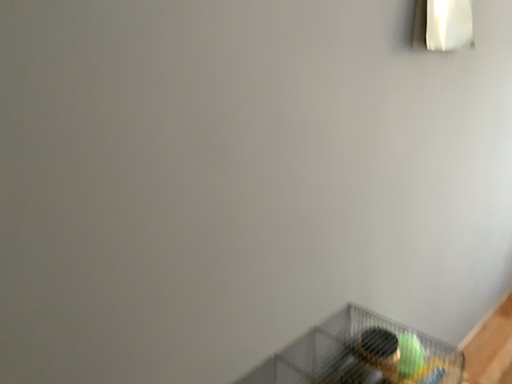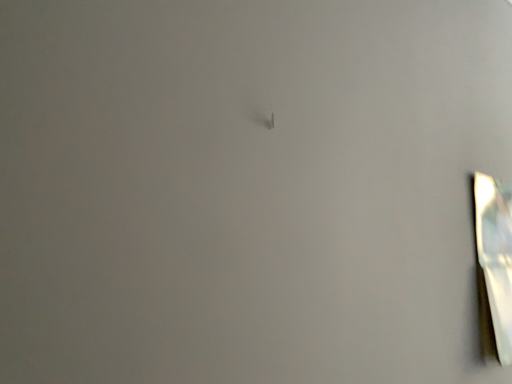
Question: Which way did the camera rotate in the video?

Choices:
 (A) rotated upward
 (B) rotated downward

Answer: (A)